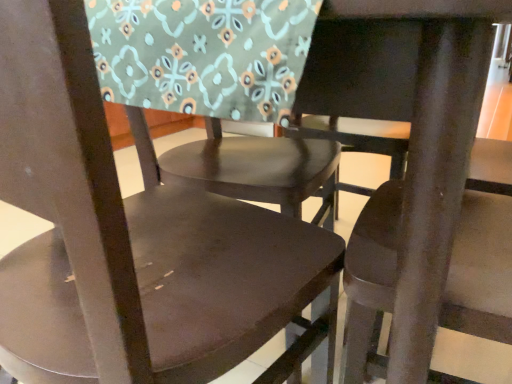
Question: Is matte brown chair at center, placed as the second chair when sorted from right to left, positioned beyond the bounds of matte brown chair at center, which ranks as the third chair in left-to-right order?

Choices:
 (A) no
 (B) yes

Answer: (B)

Question: Is matte brown chair at center, arranged as the 2th chair when viewed from the left, in front of matte brown chair at center, which appears as the 1th chair when viewed from the right?

Choices:
 (A) no
 (B) yes

Answer: (B)

Question: From the image's perspective, is matte brown chair at center, arranged as the 2th chair when viewed from the left, beneath matte brown chair at center, which appears as the 1th chair when viewed from the right?

Choices:
 (A) yes
 (B) no

Answer: (B)

Question: Can you confirm if matte brown chair at center, arranged as the 2th chair when viewed from the left, is thinner than matte brown chair at center, which appears as the 1th chair when viewed from the right?

Choices:
 (A) yes
 (B) no

Answer: (B)

Question: Is matte brown chair at center, arranged as the 2th chair when viewed from the left, oriented away from matte brown chair at center, which ranks as the third chair in left-to-right order?

Choices:
 (A) no
 (B) yes

Answer: (A)

Question: From a real-world perspective, relative to matte brown chair at center, placed as the second chair when sorted from right to left, is matte brown chair at center, which is counted as the first chair, starting from the left, vertically above or below?

Choices:
 (A) below
 (B) above

Answer: (A)

Question: Is matte brown chair at center, which is counted as the first chair, starting from the left, in front of or behind matte brown chair at center, placed as the second chair when sorted from right to left, in the image?

Choices:
 (A) front
 (B) behind

Answer: (A)

Question: Is point (254, 225) positioned closer to the camera than point (309, 36)?

Choices:
 (A) closer
 (B) farther

Answer: (B)

Question: From the image's perspective, relative to matte brown chair at center, arranged as the 2th chair when viewed from the left, is matte brown chair at center, which is counted as the first chair, starting from the left, above or below?

Choices:
 (A) below
 (B) above

Answer: (A)

Question: Is matte brown chair at center, which appears as the 1th chair when viewed from the right, inside the boundaries of matte brown chair at center, which is counted as the first chair, starting from the left, or outside?

Choices:
 (A) inside
 (B) outside

Answer: (B)

Question: Relative to matte brown chair at center, the 3th chair viewed from the right, is matte brown chair at center, which appears as the 1th chair when viewed from the right, in front or behind?

Choices:
 (A) front
 (B) behind

Answer: (B)

Question: From their relative heights in the image, would you say matte brown chair at center, which appears as the 1th chair when viewed from the right, is taller or shorter than matte brown chair at center, which is counted as the first chair, starting from the left?

Choices:
 (A) tall
 (B) short

Answer: (B)

Question: From the image's perspective, is matte brown chair at center, which ranks as the third chair in left-to-right order, positioned above or below matte brown chair at center, the 3th chair viewed from the right?

Choices:
 (A) below
 (B) above

Answer: (A)

Question: From the image's perspective, is matte brown chair at center, which ranks as the third chair in left-to-right order, located above or below matte brown chair at center, placed as the second chair when sorted from right to left?

Choices:
 (A) above
 (B) below

Answer: (B)

Question: Would you say matte brown chair at center, which appears as the 1th chair when viewed from the right, is inside or outside matte brown chair at center, arranged as the 2th chair when viewed from the left?

Choices:
 (A) inside
 (B) outside

Answer: (B)